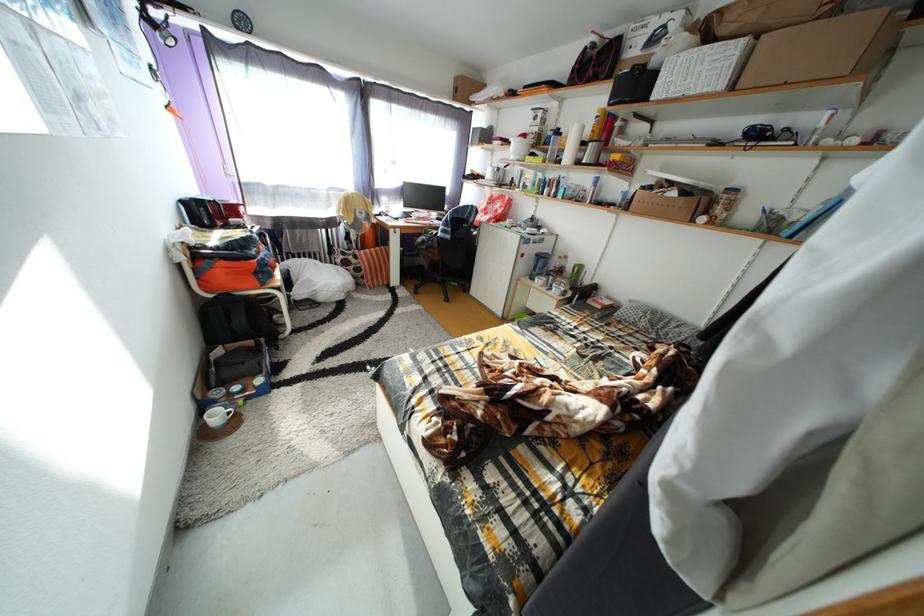
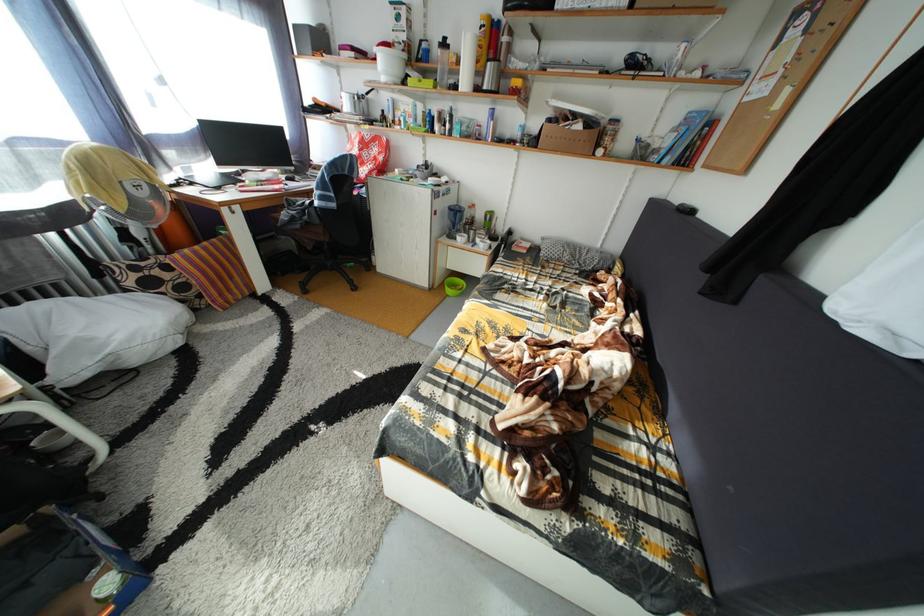
Question: The camera is either moving clockwise (left) or counter-clockwise (right) around the object. The first image is from the beginning of the video and the second image is from the end. Is the camera moving left or right when shooting the video?

Choices:
 (A) Left
 (B) Right

Answer: (A)